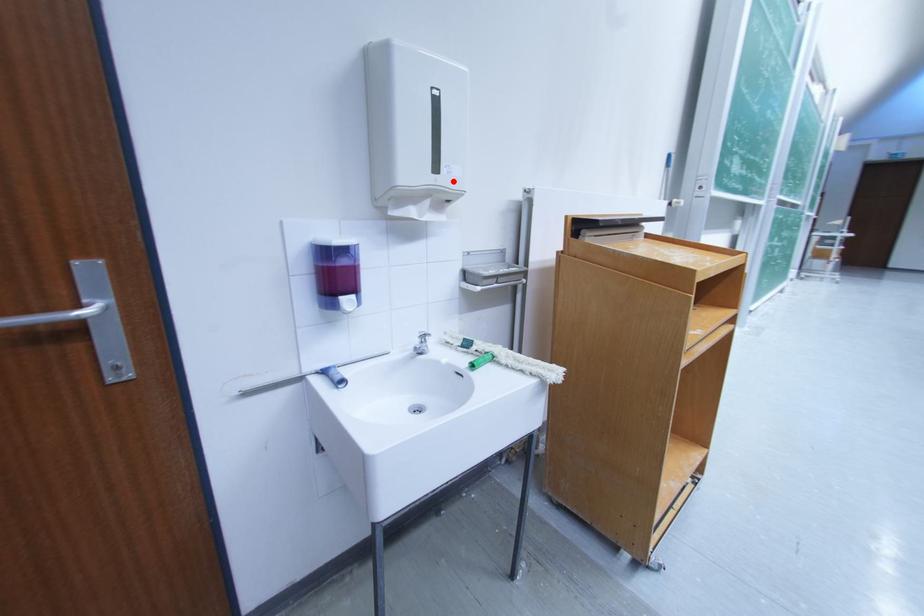
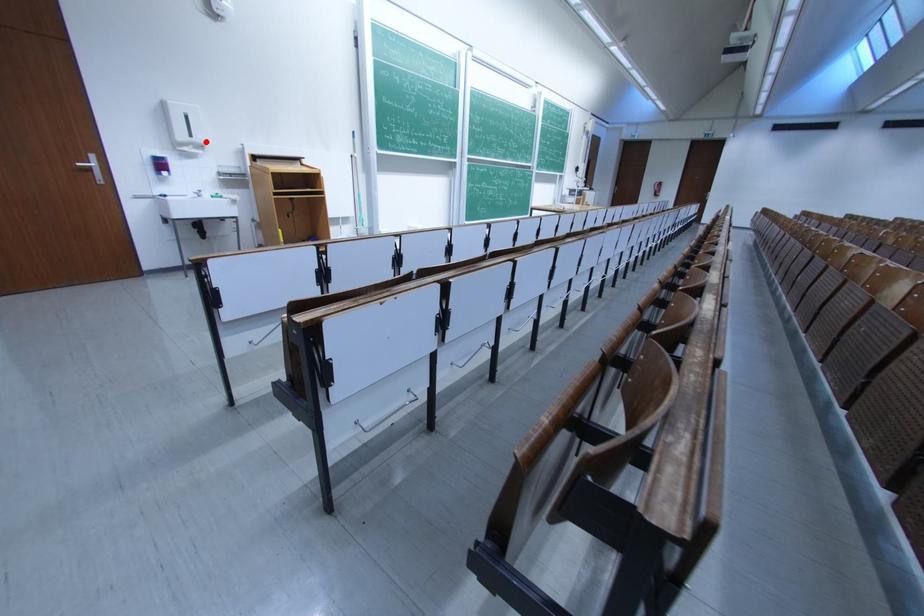
I am providing you with two images of the same scene from different viewpoints. A red point is marked on the first image and another point is marked on the second image. Is the red point in image1 aligned with the point shown in image2?

Yes